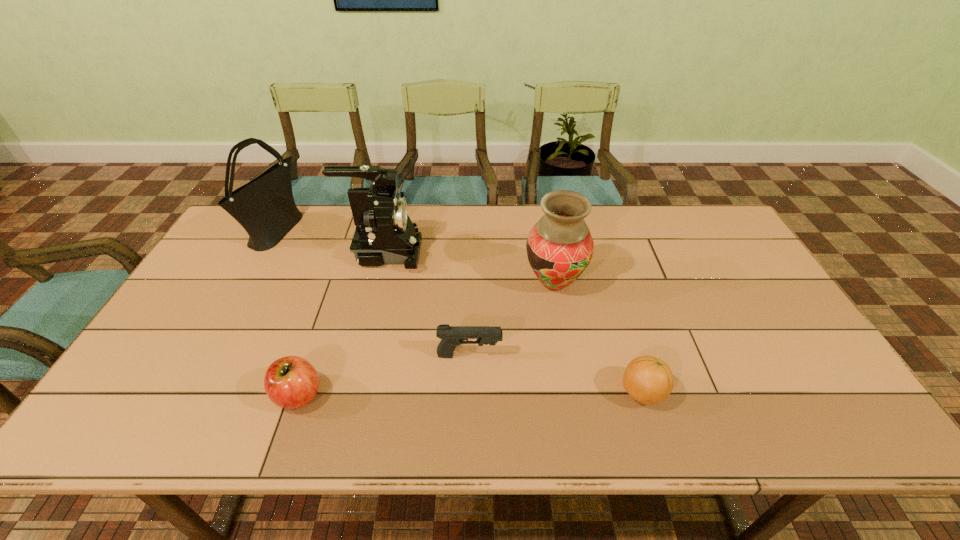
Locate an element on the screen. free space located 0.160m on the left of the apple is located at coordinates (205, 395).

You are a GUI agent. You are given a task and a screenshot of the screen. Output one action in this format:
    pyautogui.click(x=<x>, y=<y>)
    Task: Click on the free space located at the barrel of the third nearest object
    The height and width of the screenshot is (540, 960).
    Given the screenshot: What is the action you would take?
    pyautogui.click(x=605, y=355)

Locate an element on the screen. blank area located on the back of the rightmost object is located at coordinates (631, 356).

The width and height of the screenshot is (960, 540). In order to click on shoulder bag situated at the far edge in this screenshot , I will do `click(265, 207)`.

Where is `camcorder present at the far edge`? The height and width of the screenshot is (540, 960). camcorder present at the far edge is located at coordinates (385, 235).

This screenshot has width=960, height=540. In order to click on apple that is at the near edge in this screenshot , I will do `click(291, 382)`.

Locate an element on the screen. The width and height of the screenshot is (960, 540). orange located in the near edge section of the desktop is located at coordinates (649, 380).

At what (x,y) coordinates should I click in order to perform the action: click on object that is at the left edge. Please return your answer as a coordinate pair (x, y). Looking at the image, I should click on (265, 207).

You are a GUI agent. You are given a task and a screenshot of the screen. Output one action in this format:
    pyautogui.click(x=<x>, y=<y>)
    Task: Click on the object that is at the far left corner
    
    Given the screenshot: What is the action you would take?
    pyautogui.click(x=265, y=207)

At what (x,y) coordinates should I click in order to perform the action: click on vacant region at the far edge of the desktop. Please return your answer as a coordinate pair (x, y). This screenshot has height=540, width=960. Looking at the image, I should click on (461, 247).